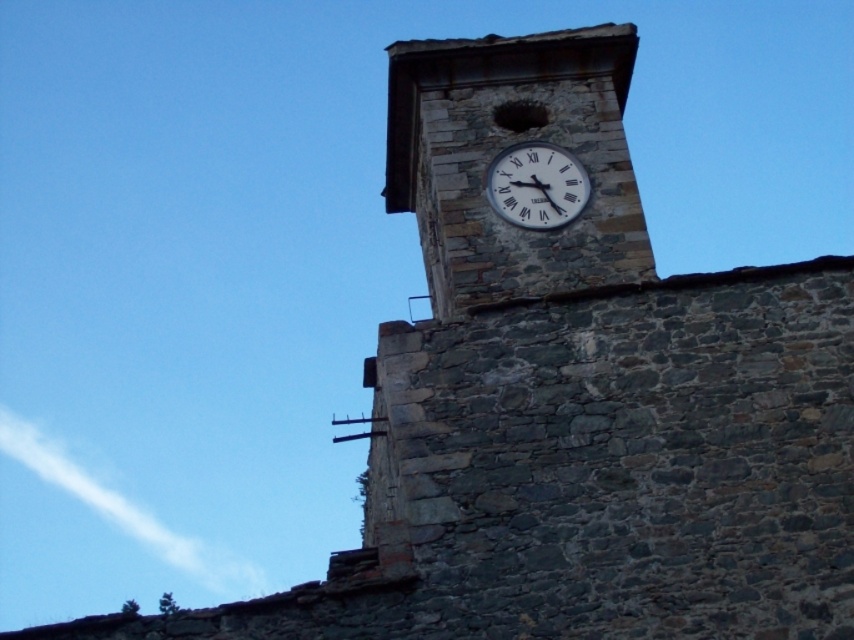
This screenshot has height=640, width=854. Describe the element at coordinates (506, 147) in the screenshot. I see `rustic stone clock tower at upper center` at that location.

Does rustic stone clock tower at upper center appear on the left side of white matte clock at upper center?

Yes, rustic stone clock tower at upper center is to the left of white matte clock at upper center.

Which is behind, point (562, 252) or point (502, 204)?

The point (502, 204) is behind.

This screenshot has width=854, height=640. I want to click on rustic stone clock tower at upper center, so click(x=506, y=147).